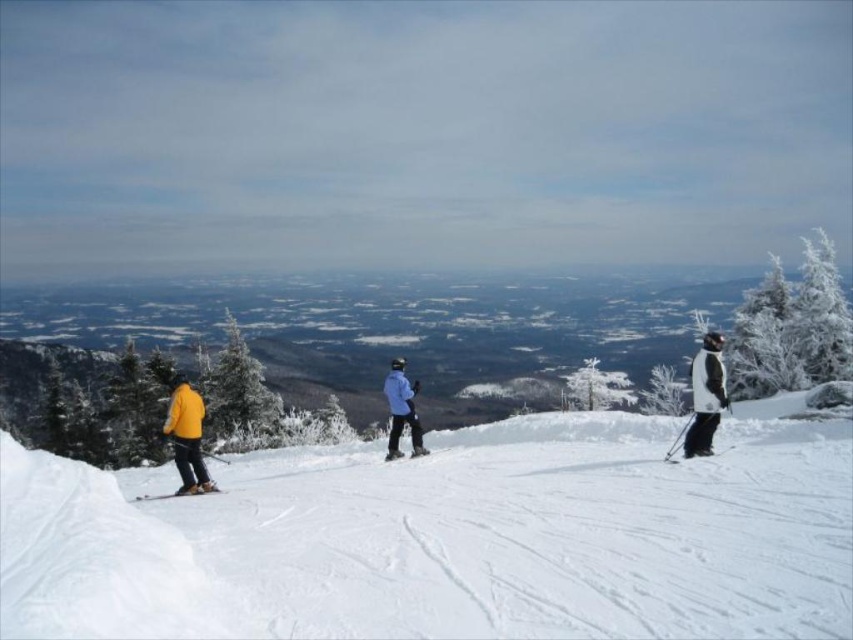
Is yellow matte jacket at left bigger than matte black ski at center?

Indeed, yellow matte jacket at left has a larger size compared to matte black ski at center.

Is point (181, 410) behind point (415, 451)?

No, (181, 410) is closer to viewer.

Find the location of a particular element. yellow matte jacket at left is located at coordinates (187, 436).

Is white powdery snow at center above white matte jacket at right?

Actually, white powdery snow at center is below white matte jacket at right.

How far apart are white powdery snow at center and white matte jacket at right?

7.00 meters

Does point (252, 465) come behind point (706, 433)?

That is True.

Find the location of a particular element. This screenshot has width=853, height=640. white powdery snow at center is located at coordinates 450,540.

Is white powdery snow at center wider than matte black ski at center?

Correct, the width of white powdery snow at center exceeds that of matte black ski at center.

Is point (627, 480) farther from viewer compared to point (412, 454)?

No.

Locate an element on the screen. white powdery snow at center is located at coordinates (450, 540).